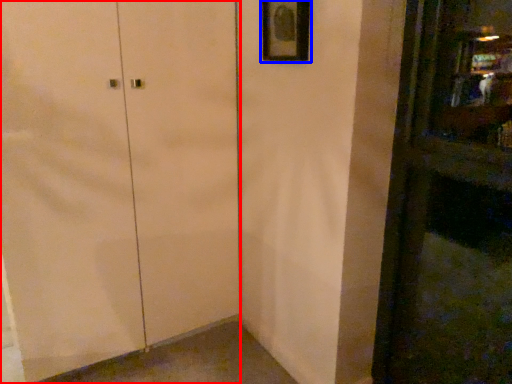
Question: Which point is closer to the camera, door (highlighted by a red box) or picture frame (highlighted by a blue box)?

Choices:
 (A) door
 (B) picture frame

Answer: (A)